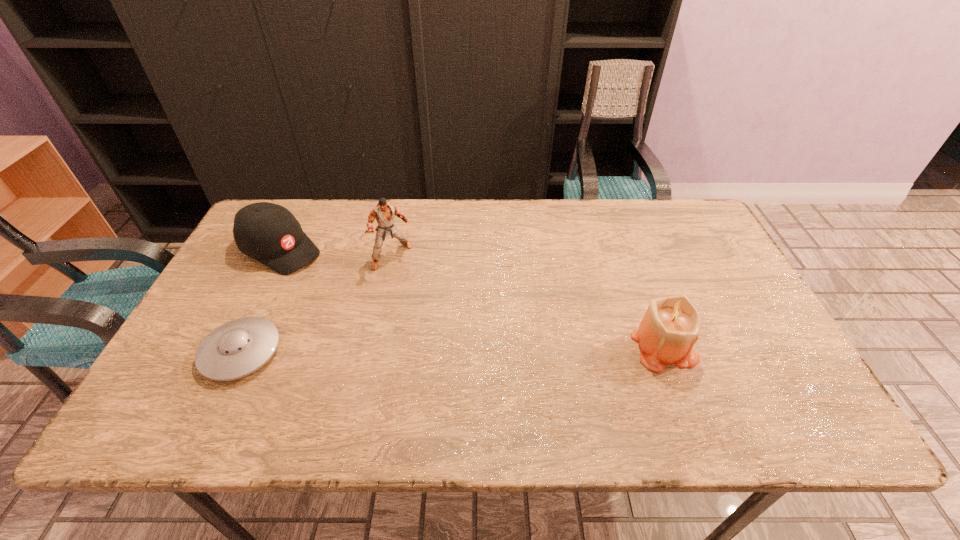
This screenshot has height=540, width=960. Identify the location of saucer. (237, 348).

Locate an element on the screen. This screenshot has height=540, width=960. the third shortest object is located at coordinates (670, 327).

Where is `the rightmost object`? This screenshot has height=540, width=960. the rightmost object is located at coordinates (670, 327).

Image resolution: width=960 pixels, height=540 pixels. Identify the location of puncher. (384, 213).

At what (x,y) coordinates should I click in order to perform the action: click on baseball cap. Please return your answer as a coordinate pair (x, y). Looking at the image, I should click on (269, 233).

Where is `vacant area situated 0.370m on the back of the saucer`? vacant area situated 0.370m on the back of the saucer is located at coordinates (298, 232).

Where is `vacant space positioned 0.110m on the back of the candle`? vacant space positioned 0.110m on the back of the candle is located at coordinates (643, 289).

Locate an element on the screen. This screenshot has height=540, width=960. free spot located 0.400m on the front-facing side of the puncher is located at coordinates (480, 364).

The height and width of the screenshot is (540, 960). I want to click on free spot located 0.120m on the front-facing side of the puncher, so click(x=421, y=293).

Identify the location of blank area located on the front-facing side of the puncher. The width and height of the screenshot is (960, 540). (467, 347).